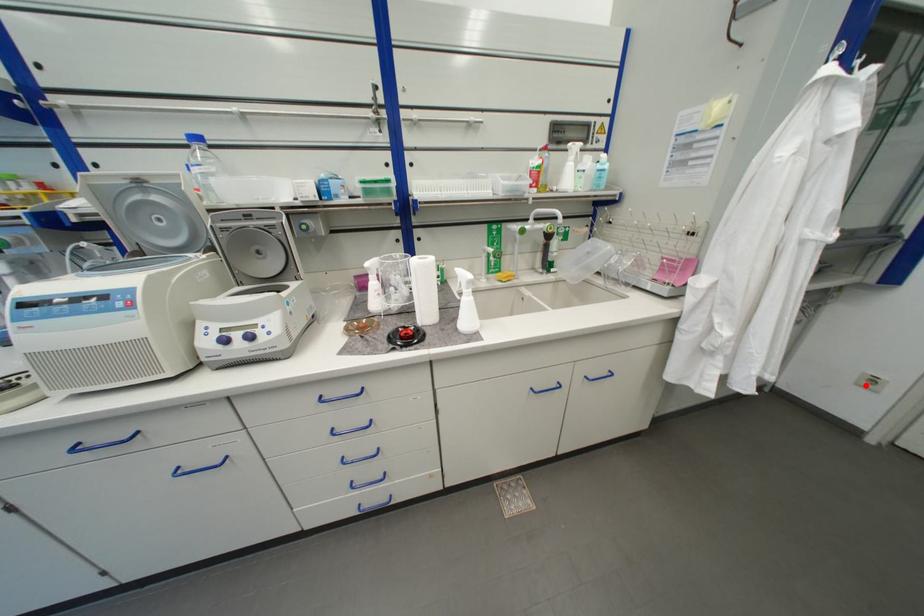
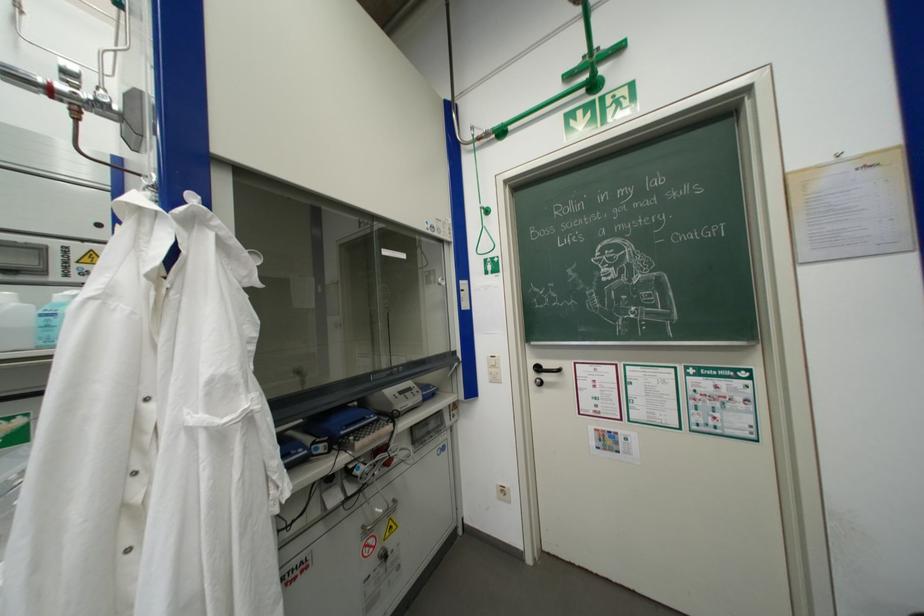
Find the pixel in the second image that matches the highlighted location in the first image.

(506, 500)